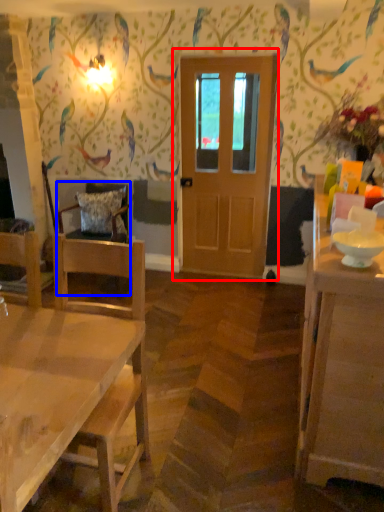
Question: Which point is closer to the camera, door (highlighted by a red box) or chair (highlighted by a blue box)?

Choices:
 (A) door
 (B) chair

Answer: (A)